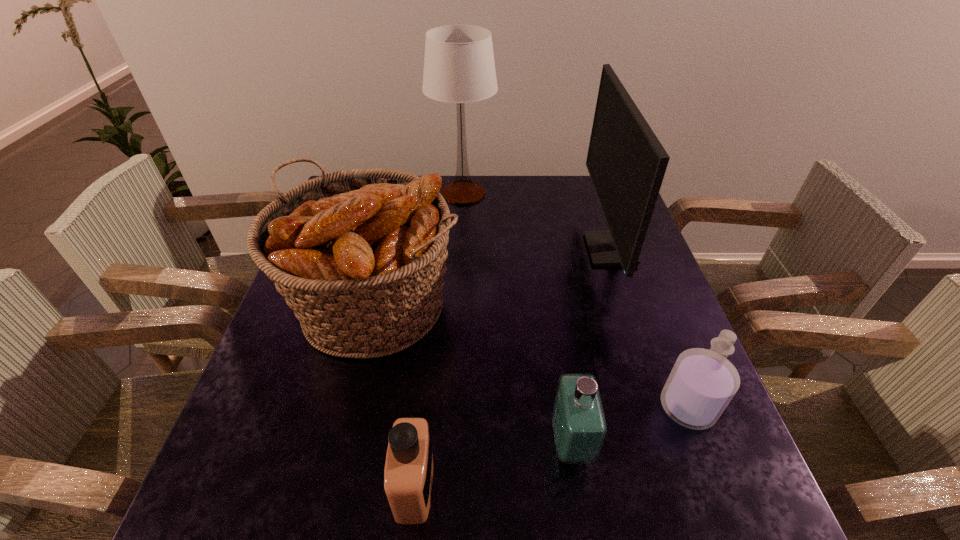
Find the location of a particular element. This screenshot has width=960, height=540. table lamp is located at coordinates (459, 67).

Where is `computer monitor`? computer monitor is located at coordinates (626, 162).

The height and width of the screenshot is (540, 960). What are the coordinates of `the fourth shortest object` in the screenshot? It's located at [360, 255].

Where is `the rightmost perfume`? the rightmost perfume is located at coordinates (702, 383).

Where is `the fourth object from left to right`? the fourth object from left to right is located at coordinates (579, 426).

This screenshot has height=540, width=960. What are the coordinates of `the leftmost perfume` in the screenshot? It's located at (408, 475).

The image size is (960, 540). What are the coordinates of `vacant space located 0.250m above the cylindrical shade of the table lamp` in the screenshot? It's located at (572, 193).

Locate an element on the screen. The width and height of the screenshot is (960, 540). vacant space located 0.220m on the front-facing side of the computer monitor is located at coordinates (508, 249).

Where is `vacant space located on the front-facing side of the computer monitor`? The width and height of the screenshot is (960, 540). vacant space located on the front-facing side of the computer monitor is located at coordinates (501, 249).

The height and width of the screenshot is (540, 960). In order to click on vacant space located 0.280m on the front-facing side of the computer monitor in this screenshot , I will do `click(487, 249)`.